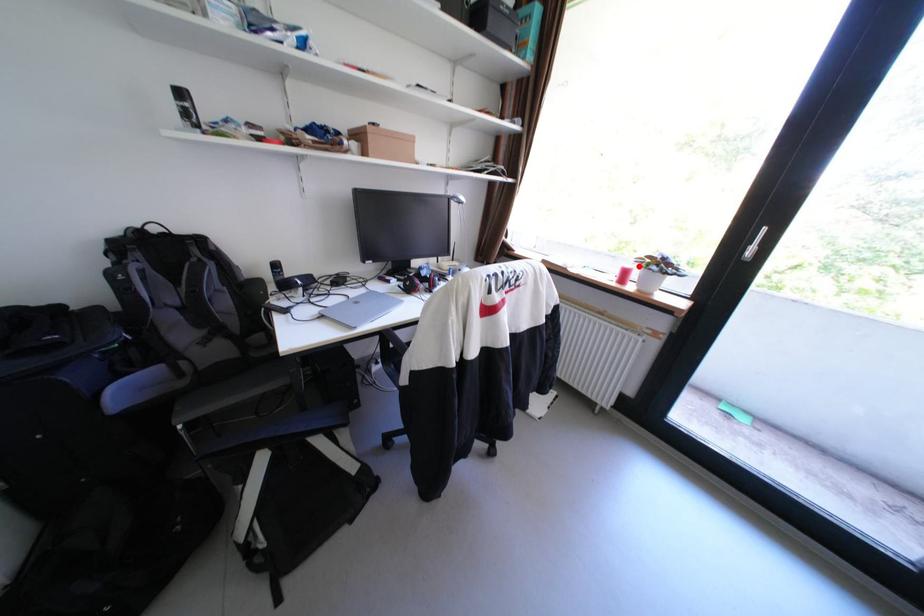
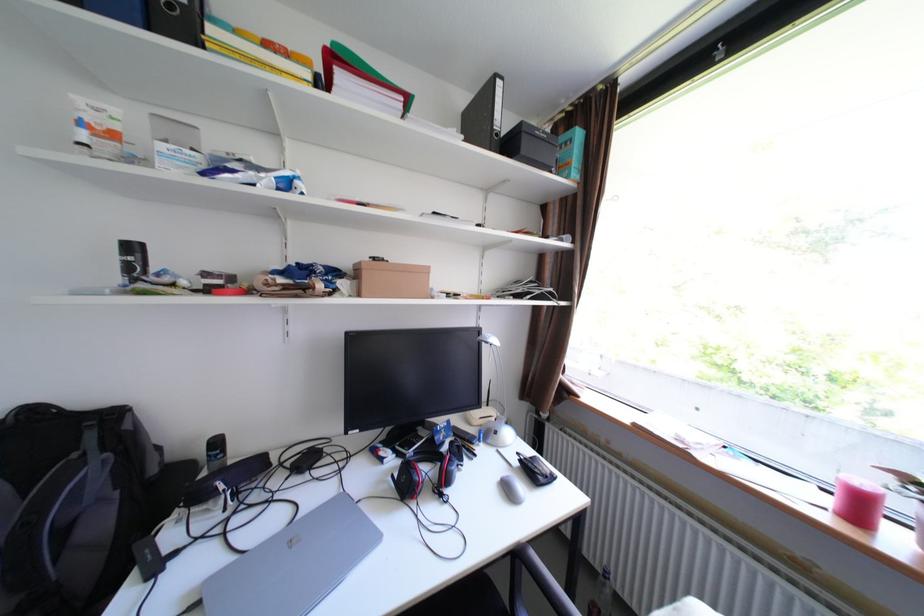
Question: A red point is marked in image1. In image2, is the corresponding 3D point closer to the camera or farther? Reply with the corresponding letter.

Choices:
 (A) The corresponding 3D point is closer.
 (B) The corresponding 3D point is farther.

Answer: (B)